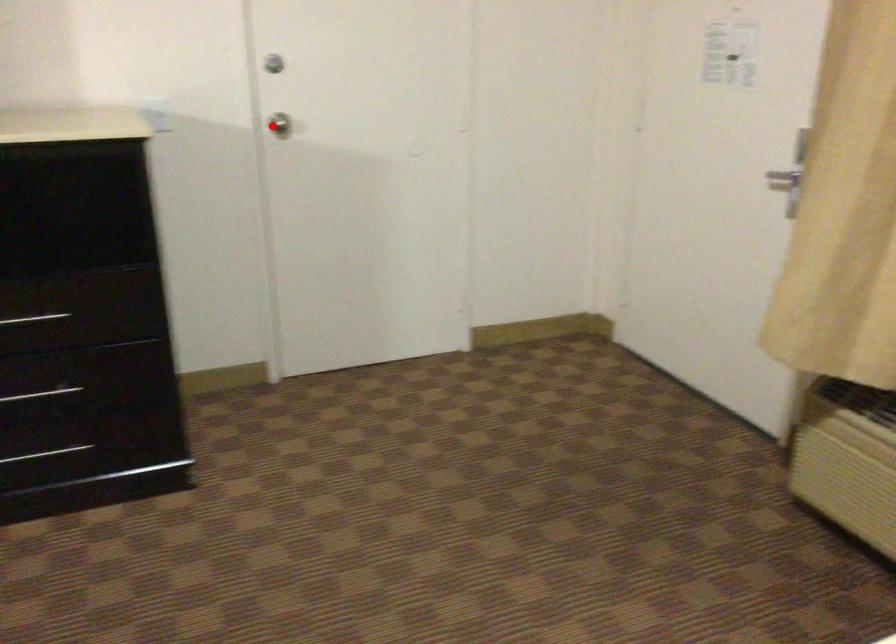
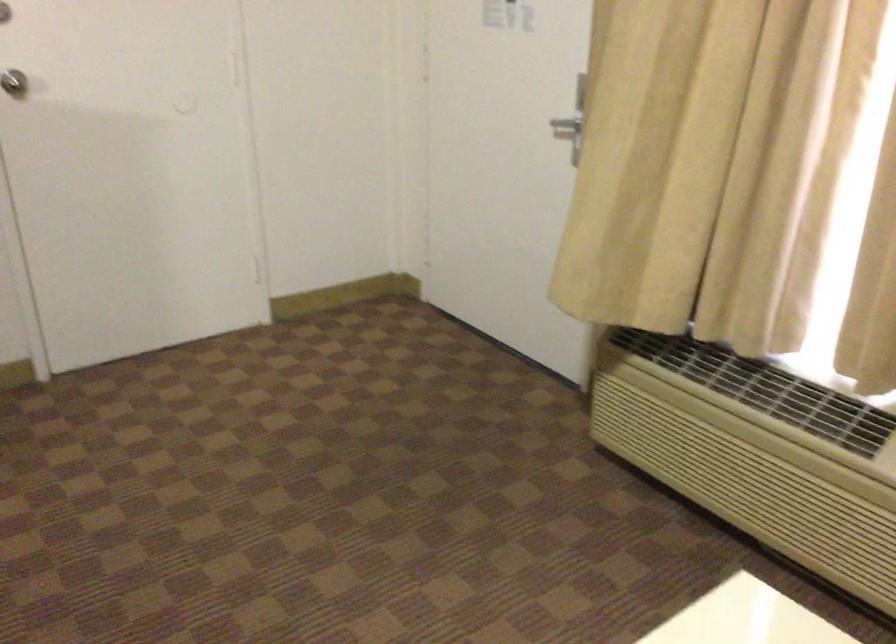
Where in the second image is the point corresponding to the highlighted location from the first image?

(13, 82)